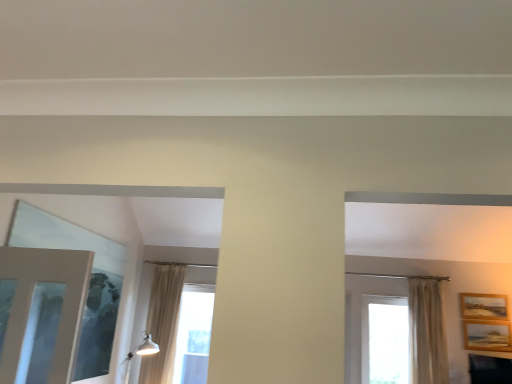
Question: Which is correct: white sheer curtain at right is inside black glossy tv at lower right, or outside of it?

Choices:
 (A) inside
 (B) outside

Answer: (B)

Question: Looking at their shapes, would you say white sheer curtain at right is wider or thinner than black glossy tv at lower right?

Choices:
 (A) wide
 (B) thin

Answer: (A)

Question: Which object is the farthest from the white glossy light fixture at lower left?

Choices:
 (A) white sheer curtain at right
 (B) wooden picture frame at upper right, which is the second picture frame from bottom to top
 (C) beige curtain at center, positioned as the 3th window in right-to-left order
 (D) black glossy tv at lower right
 (E) wooden textured picture frame at right, which appears as the second picture frame when viewed from the top

Answer: (B)

Question: Which of these objects is positioned farthest from the wooden picture frame at upper right, which is the second picture frame from bottom to top?

Choices:
 (A) white sheer curtain at right
 (B) black glossy tv at lower right
 (C) transparent glass window at center, the 1th window in the right-to-left sequence
 (D) transparent glass window at center, the 2th window in the right-to-left sequence
 (E) beige curtain at center, positioned as the 3th window in right-to-left order

Answer: (E)